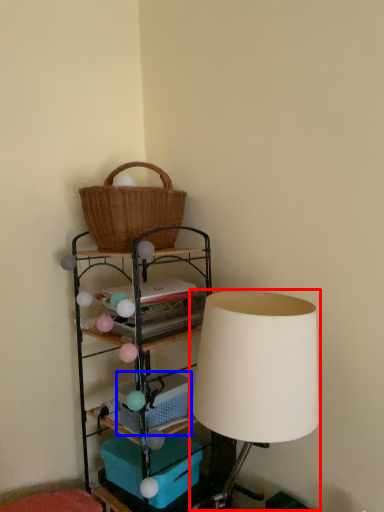
Question: Which object appears closest to the camera in this image, table lamp (highlighted by a red box) or basket (highlighted by a blue box)?

Choices:
 (A) table lamp
 (B) basket

Answer: (A)